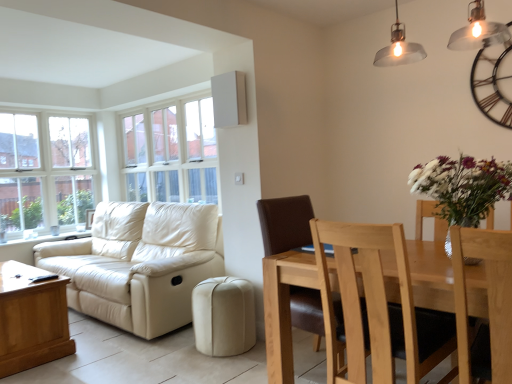
Image resolution: width=512 pixels, height=384 pixels. What do you see at coordinates (44, 174) in the screenshot? I see `clear glass window at left, the 1th window viewed from the left` at bounding box center [44, 174].

This screenshot has width=512, height=384. Find the location of `light brown wood chair at lower right, acting as the 2th chair starting from the front`. light brown wood chair at lower right, acting as the 2th chair starting from the front is located at coordinates (377, 307).

How much space does light brown wooden chair at right, positioned as the first chair in front-to-back order, occupy horizontally?

It is 22.02 inches.

This screenshot has width=512, height=384. Describe the element at coordinates (224, 316) in the screenshot. I see `beige leather ottoman at lower center` at that location.

In order to click on brown leather chair at center, arranged as the third chair when viewed from the front in this screenshot , I will do `click(285, 223)`.

Where is `metallic black clock at upper right`? metallic black clock at upper right is located at coordinates (493, 83).

What do you see at coordinates (141, 269) in the screenshot?
I see `beige leather couch at left` at bounding box center [141, 269].

What is the approximate width of white glass window at upper center, placed as the first window when sorted from right to left?

Result: The width of white glass window at upper center, placed as the first window when sorted from right to left, is 8.98 inches.

In order to click on clear glass window at left, the 1th window viewed from the left in this screenshot , I will do `click(44, 174)`.

Is white glass window at upper center, which appears as the second window when viewed from the left, not near light brown wood chair at lower right, arranged as the 2th chair when viewed from the back?

white glass window at upper center, which appears as the second window when viewed from the left, is positioned a significant distance from light brown wood chair at lower right, arranged as the 2th chair when viewed from the back.

From a real-world perspective, is white glass window at upper center, placed as the first window when sorted from right to left, physically below light brown wood chair at lower right, acting as the 2th chair starting from the front?

No, from a real-world perspective, white glass window at upper center, placed as the first window when sorted from right to left, is not below light brown wood chair at lower right, acting as the 2th chair starting from the front.

From the image's perspective, which is above, white glass window at upper center, placed as the first window when sorted from right to left, or light brown wood chair at lower right, arranged as the 2th chair when viewed from the back?

white glass window at upper center, placed as the first window when sorted from right to left, is shown above in the image.

Who is bigger, white glass window at upper center, which appears as the second window when viewed from the left, or light brown wood chair at lower right, acting as the 2th chair starting from the front?

light brown wood chair at lower right, acting as the 2th chair starting from the front, is bigger.

Considering the sizes of objects beige leather ottoman at lower center and light brown wood chair at lower right, acting as the 2th chair starting from the front, in the image provided, who is wider, beige leather ottoman at lower center or light brown wood chair at lower right, acting as the 2th chair starting from the front,?

light brown wood chair at lower right, acting as the 2th chair starting from the front, is wider.

From a real-world perspective, is beige leather ottoman at lower center physically above light brown wood chair at lower right, acting as the 2th chair starting from the front?

No, from a real-world perspective, beige leather ottoman at lower center is not on top of light brown wood chair at lower right, acting as the 2th chair starting from the front.

Does point (238, 328) appear closer or farther from the camera than point (424, 359)?

Clearly, point (238, 328) is more distant from the camera than point (424, 359).

Which of these two, beige leather ottoman at lower center or light brown wood chair at lower right, arranged as the 2th chair when viewed from the back, is smaller?

beige leather ottoman at lower center.

Is light brown wooden coffee table at lower left positioned before beige leather ottoman at lower center?

Yes, it is in front of beige leather ottoman at lower center.

From the image's perspective, would you say light brown wooden coffee table at lower left is shown under beige leather ottoman at lower center?

Yes, from the image's perspective, light brown wooden coffee table at lower left is below beige leather ottoman at lower center.

From a real-world perspective, who is located lower, light brown wooden coffee table at lower left or beige leather ottoman at lower center?

From a 3D spatial view, beige leather ottoman at lower center is below.

What's the angular difference between matte silver pendant light at upper right and white glass window at upper center, which appears as the second window when viewed from the left,'s facing directions?

There is a 3.51-degree angle between the facing directions of matte silver pendant light at upper right and white glass window at upper center, which appears as the second window when viewed from the left.

In terms of height, does matte silver pendant light at upper right look taller or shorter compared to white glass window at upper center, which appears as the second window when viewed from the left?

matte silver pendant light at upper right is shorter than white glass window at upper center, which appears as the second window when viewed from the left.

From a real-world perspective, which object rests below the other?

white glass window at upper center, placed as the first window when sorted from right to left.

Does white glass window at upper center, placed as the first window when sorted from right to left, touch light brown wooden chair at right, positioned as the first chair in front-to-back order?

No, white glass window at upper center, placed as the first window when sorted from right to left, is not beside light brown wooden chair at right, positioned as the first chair in front-to-back order.

Measure the distance between white glass window at upper center, placed as the first window when sorted from right to left, and light brown wooden chair at right, which is the third chair from back to front.

white glass window at upper center, placed as the first window when sorted from right to left, is 3.51 meters away from light brown wooden chair at right, which is the third chair from back to front.

Is white glass window at upper center, which appears as the second window when viewed from the left, bigger or smaller than light brown wooden chair at right, which is the third chair from back to front?

white glass window at upper center, which appears as the second window when viewed from the left, is bigger than light brown wooden chair at right, which is the third chair from back to front.

From a real-world perspective, starting from the light brown wooden chair at right, positioned as the first chair in front-to-back order, which window is the 2nd one vertically above it? Please provide its 2D coordinates.

[(170, 153)]

From a real-world perspective, between light brown wooden coffee table at lower left and brown leather chair at center, placed as the first chair when sorted from back to front, who is vertically higher?

brown leather chair at center, placed as the first chair when sorted from back to front, is physically above.

Can you confirm if light brown wooden coffee table at lower left is smaller than brown leather chair at center, placed as the first chair when sorted from back to front?

Actually, light brown wooden coffee table at lower left might be larger than brown leather chair at center, placed as the first chair when sorted from back to front.

The image size is (512, 384). In order to click on table that is below the brown leather chair at center, placed as the first chair when sorted from back to front (from the image's perspective) in this screenshot , I will do coord(31,319).

Does point (57, 355) come behind point (279, 234)?

Yes, it is behind point (279, 234).

From the image's perspective, is white matte vase at right below light brown wooden chair at right, positioned as the first chair in front-to-back order?

No.

Is white matte vase at right not within light brown wooden chair at right, which is the third chair from back to front?

Absolutely, white matte vase at right is external to light brown wooden chair at right, which is the third chair from back to front.

At what (x,y) coordinates should I click in order to perform the action: click on floral arrangement above the light brown wooden chair at right, positioned as the first chair in front-to-back order (from a real-world perspective). Please return your answer as a coordinate pair (x, y). Looking at the image, I should click on (463, 186).

Is white matte vase at right aimed at light brown wooden chair at right, which is the third chair from back to front?

No.

I want to click on the 2nd window directly above the light brown wood chair at lower right, arranged as the 2th chair when viewed from the back (from a real-world perspective), so click(x=170, y=153).

There is a beige leather ottoman at lower center. In order to click on the 1st chair above it (from the image's perspective) in this screenshot , I will do `click(377, 307)`.

Looking at the image, which one is located closer to light brown wooden coffee table at lower left, white matte vase at right or light brown wooden chair at right, which is the third chair from back to front?

The object closer to light brown wooden coffee table at lower left is white matte vase at right.

Estimate the real-world distances between objects in this image. Which object is closer to metallic black clock at upper right, light brown wooden chair at right, which is the third chair from back to front, or light brown wooden coffee table at lower left?

light brown wooden chair at right, which is the third chair from back to front, lies closer to metallic black clock at upper right than the other object.

When comparing their distances from metallic black clock at upper right, does white glass window at upper center, placed as the first window when sorted from right to left, or light brown wood chair at lower right, acting as the 2th chair starting from the front, seem closer?

light brown wood chair at lower right, acting as the 2th chair starting from the front, is closer to metallic black clock at upper right.

Based on their spatial positions, is metallic black clock at upper right or white matte vase at right further from light brown wooden chair at right, positioned as the first chair in front-to-back order?

Based on the image, metallic black clock at upper right appears to be further to light brown wooden chair at right, positioned as the first chair in front-to-back order.

Looking at the image, which one is located closer to white glass window at upper center, which appears as the second window when viewed from the left, beige leather couch at left or beige leather ottoman at lower center?

beige leather couch at left is closer to white glass window at upper center, which appears as the second window when viewed from the left.

Looking at the image, which one is located further to light brown wooden chair at right, which is the third chair from back to front, light brown wooden coffee table at lower left or beige leather ottoman at lower center?

light brown wooden coffee table at lower left is positioned further to the anchor light brown wooden chair at right, which is the third chair from back to front.

Considering their positions, is matte silver pendant light at upper right positioned closer to white glass window at upper center, placed as the first window when sorted from right to left, than light brown wood chair at lower right, acting as the 2th chair starting from the front?

matte silver pendant light at upper right.

When comparing their distances from brown leather chair at center, arranged as the third chair when viewed from the front, does matte silver pendant light at upper right or light brown wooden coffee table at lower left seem further?

light brown wooden coffee table at lower left is positioned further to the anchor brown leather chair at center, arranged as the third chair when viewed from the front.

The image size is (512, 384). Identify the location of window between light brown wooden coffee table at lower left and brown leather chair at center, placed as the first chair when sorted from back to front, in the horizontal direction. (170, 153).

At what (x,y) coordinates should I click in order to perform the action: click on floral arrangement positioned between light brown wooden chair at right, which is the third chair from back to front, and white glass window at upper center, placed as the first window when sorted from right to left, from near to far. Please return your answer as a coordinate pair (x, y). The image size is (512, 384). Looking at the image, I should click on (463, 186).

Find the location of a particular element. This screenshot has height=384, width=512. table between clear glass window at left, the 2th window in the right-to-left sequence, and brown leather chair at center, placed as the first chair when sorted from back to front, in the horizontal direction is located at coordinates (31, 319).

You are a GUI agent. You are given a task and a screenshot of the screen. Output one action in this format:
    pyautogui.click(x=<x>, y=<y>)
    Task: Click on the window between light brown wooden coffee table at lower left and white matte vase at right from left to right
    
    Given the screenshot: What is the action you would take?
    pyautogui.click(x=170, y=153)